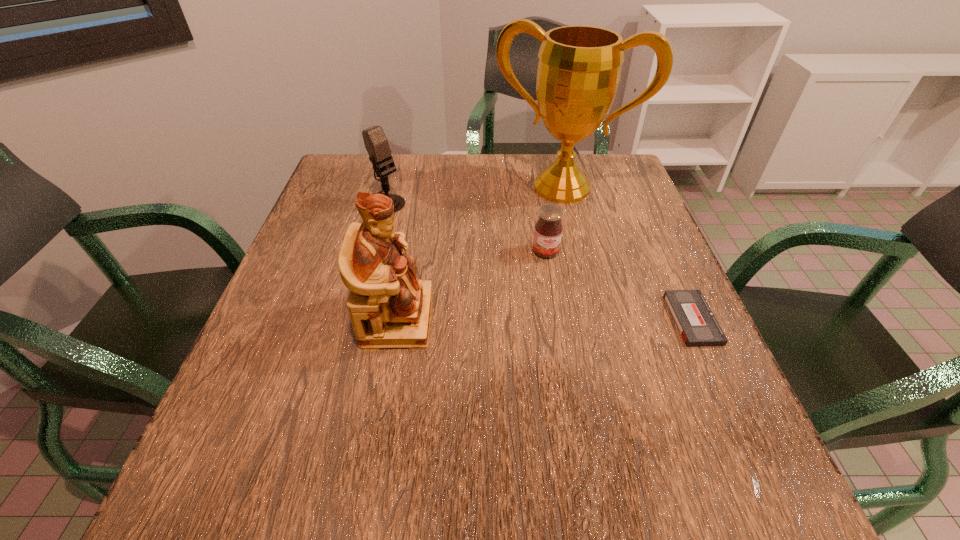
Locate an element on the screen. The image size is (960, 540). vacant space on the desktop that is between the figurine and the videotape and is positioned on the label side of the jam is located at coordinates (563, 319).

I want to click on vacant spot on the desktop that is between the fourth shortest object and the shortest object and is positioned on the front-facing side of the award, so click(x=508, y=319).

Image resolution: width=960 pixels, height=540 pixels. I want to click on free space on the desktop that is between the figurine and the videotape and is positioned on the front-facing side of the third tallest object, so click(576, 319).